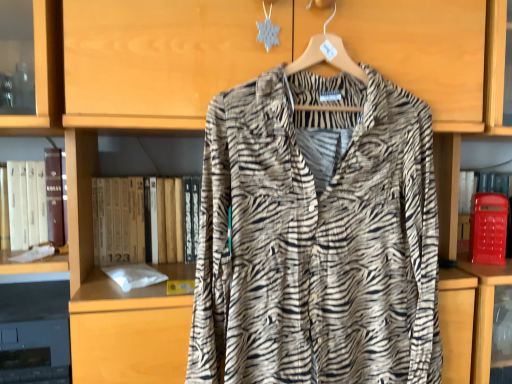
Locate an element on the screen. zebra-patterned fabric shirt at center is located at coordinates (317, 236).

The height and width of the screenshot is (384, 512). What do you see at coordinates (36, 202) in the screenshot?
I see `white paper at left, placed as the 1th book when sorted from left to right` at bounding box center [36, 202].

The width and height of the screenshot is (512, 384). Identify the location of hardcover book at center, positioned as the first book in right-to-left order. (142, 220).

Image resolution: width=512 pixels, height=384 pixels. I want to click on matte red phone box at right, so click(488, 228).

From the image's perspective, between white paper at left, placed as the 1th book when sorted from left to right, and hardcover book at center, positioned as the first book in right-to-left order, who is located below?

hardcover book at center, positioned as the first book in right-to-left order, appears lower in the image.

Is white paper at left, the 2th book viewed from the right, bigger than hardcover book at center, the second book when ordered from left to right?

Incorrect, white paper at left, the 2th book viewed from the right, is not larger than hardcover book at center, the second book when ordered from left to right.

The image size is (512, 384). I want to click on book located behind the white paper at left, the 2th book viewed from the right, so click(x=142, y=220).

Between white paper at left, placed as the 1th book when sorted from left to right, and hardcover book at center, positioned as the first book in right-to-left order, which one has smaller width?

Thinner between the two is white paper at left, placed as the 1th book when sorted from left to right.

Are matte red phone box at right and zebra-patterned fabric shirt at center beside each other?

They are not placed beside each other.

Which object is more forward, matte red phone box at right or zebra-patterned fabric shirt at center?

Positioned in front is zebra-patterned fabric shirt at center.

Which of these two, matte red phone box at right or zebra-patterned fabric shirt at center, stands shorter?

Standing shorter between the two is matte red phone box at right.

Is matte red phone box at right oriented towards zebra-patterned fabric shirt at center?

No.

Based on their sizes in the image, would you say hardcover book at center, positioned as the first book in right-to-left order, is bigger or smaller than matte red phone box at right?

In the image, hardcover book at center, positioned as the first book in right-to-left order, appears to be larger than matte red phone box at right.

Choose the correct answer: Is hardcover book at center, the second book when ordered from left to right, inside matte red phone box at right or outside it?

hardcover book at center, the second book when ordered from left to right, is located beyond the bounds of matte red phone box at right.

From a real-world perspective, is hardcover book at center, the second book when ordered from left to right, above or below matte red phone box at right?

Clearly, from a real-world perspective, hardcover book at center, the second book when ordered from left to right, is above matte red phone box at right.

Between matte red phone box at right and white paper at left, the 2th book viewed from the right, which one appears on the right side from the viewer's perspective?

matte red phone box at right is more to the right.

Which point is more distant from viewer, (473,246) or (13,183)?

The point (473,246) is farther from the camera.

Is there a large distance between matte red phone box at right and white paper at left, the 2th book viewed from the right?

No, matte red phone box at right is not far from white paper at left, the 2th book viewed from the right.

You are a GUI agent. You are given a task and a screenshot of the screen. Output one action in this format:
    pyautogui.click(x=<x>, y=<y>)
    Task: Click on the phone box behind the white paper at left, placed as the 1th book when sorted from left to right
    This screenshot has width=512, height=384.
    Given the screenshot: What is the action you would take?
    pyautogui.click(x=488, y=228)

Looking at this image, which object is wider, hardcover book at center, the second book when ordered from left to right, or white paper at left, placed as the 1th book when sorted from left to right?

hardcover book at center, the second book when ordered from left to right.

Is white paper at left, the 2th book viewed from the right, at the back of hardcover book at center, positioned as the first book in right-to-left order?

No, hardcover book at center, positioned as the first book in right-to-left order, is not facing the opposite direction of white paper at left, the 2th book viewed from the right.

Does point (161, 231) come in front of point (44, 170)?

No.

Would you say zebra-patterned fabric shirt at center is a long distance from hardcover book at center, positioned as the first book in right-to-left order?

No.

Is zebra-patterned fabric shirt at center in front of hardcover book at center, positioned as the first book in right-to-left order?

Yes.

From the image's perspective, is zebra-patterned fabric shirt at center over hardcover book at center, positioned as the first book in right-to-left order?

Yes, from the image's perspective, zebra-patterned fabric shirt at center is over hardcover book at center, positioned as the first book in right-to-left order.

Is hardcover book at center, the second book when ordered from left to right, oriented away from zebra-patterned fabric shirt at center?

That's not correct — hardcover book at center, the second book when ordered from left to right, is not looking away from zebra-patterned fabric shirt at center.

Does hardcover book at center, positioned as the first book in right-to-left order, have a lesser height compared to zebra-patterned fabric shirt at center?

Indeed, hardcover book at center, positioned as the first book in right-to-left order, has a lesser height compared to zebra-patterned fabric shirt at center.

Are hardcover book at center, positioned as the first book in right-to-left order, and zebra-patterned fabric shirt at center making contact?

hardcover book at center, positioned as the first book in right-to-left order, and zebra-patterned fabric shirt at center are clearly separated.

This screenshot has height=384, width=512. In the image, there is a hardcover book at center, positioned as the first book in right-to-left order. Find the location of `book above it (from the image's perspective)`. book above it (from the image's perspective) is located at coordinates (36, 202).

Image resolution: width=512 pixels, height=384 pixels. What are the coordinates of `phone box on the right of zebra-patterned fabric shirt at center` in the screenshot? It's located at (488, 228).

Estimate the real-world distances between objects in this image. Which object is closer to zebra-patterned fabric shirt at center, matte red phone box at right or hardcover book at center, positioned as the first book in right-to-left order?

Based on the image, hardcover book at center, positioned as the first book in right-to-left order, appears to be nearer to zebra-patterned fabric shirt at center.

Estimate the real-world distances between objects in this image. Which object is closer to white paper at left, the 2th book viewed from the right, zebra-patterned fabric shirt at center or matte red phone box at right?

zebra-patterned fabric shirt at center is positioned closer to the anchor white paper at left, the 2th book viewed from the right.

Looking at the image, which one is located further to zebra-patterned fabric shirt at center, white paper at left, placed as the 1th book when sorted from left to right, or matte red phone box at right?

white paper at left, placed as the 1th book when sorted from left to right.

Estimate the real-world distances between objects in this image. Which object is closer to zebra-patterned fabric shirt at center, white paper at left, the 2th book viewed from the right, or hardcover book at center, the second book when ordered from left to right?

The object closer to zebra-patterned fabric shirt at center is hardcover book at center, the second book when ordered from left to right.

Considering their positions, is white paper at left, the 2th book viewed from the right, positioned closer to hardcover book at center, the second book when ordered from left to right, than matte red phone box at right?

Among the two, white paper at left, the 2th book viewed from the right, is located nearer to hardcover book at center, the second book when ordered from left to right.

From the image, which object appears to be farther from white paper at left, placed as the 1th book when sorted from left to right, hardcover book at center, positioned as the first book in right-to-left order, or matte red phone box at right?

matte red phone box at right.

Looking at the image, which one is located closer to matte red phone box at right, white paper at left, placed as the 1th book when sorted from left to right, or hardcover book at center, the second book when ordered from left to right?

Among the two, hardcover book at center, the second book when ordered from left to right, is located nearer to matte red phone box at right.

When comparing their distances from hardcover book at center, positioned as the first book in right-to-left order, does matte red phone box at right or white paper at left, placed as the 1th book when sorted from left to right, seem further?

Among the two, matte red phone box at right is located further to hardcover book at center, positioned as the first book in right-to-left order.

Identify the location of fancy dress located between hardcover book at center, positioned as the first book in right-to-left order, and matte red phone box at right in the left-right direction. (317, 236).

Where is `book between white paper at left, the 2th book viewed from the right, and zebra-patterned fabric shirt at center`? This screenshot has height=384, width=512. book between white paper at left, the 2th book viewed from the right, and zebra-patterned fabric shirt at center is located at coordinates (142, 220).

You are a GUI agent. You are given a task and a screenshot of the screen. Output one action in this format:
    pyautogui.click(x=<x>, y=<y>)
    Task: Click on the fancy dress situated between white paper at left, placed as the 1th book when sorted from left to right, and matte red phone box at right from left to right
    
    Given the screenshot: What is the action you would take?
    pyautogui.click(x=317, y=236)

Find the location of a particular element. book between white paper at left, the 2th book viewed from the right, and matte red phone box at right, in the horizontal direction is located at coordinates (142, 220).